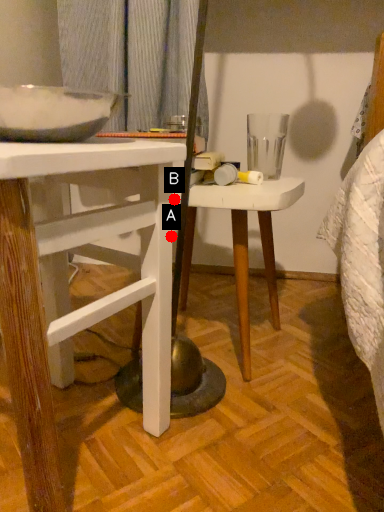
Question: Two points are circled on the image, labeled by A and B beside each circle. Which point is closer to the camera?

Choices:
 (A) A is closer
 (B) B is closer

Answer: (A)